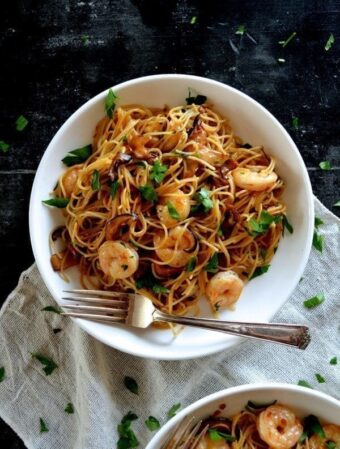
Where is `fully visible bowl`? The image size is (340, 449). fully visible bowl is located at coordinates (173, 206).